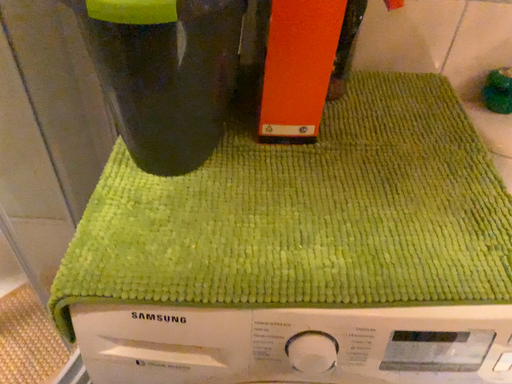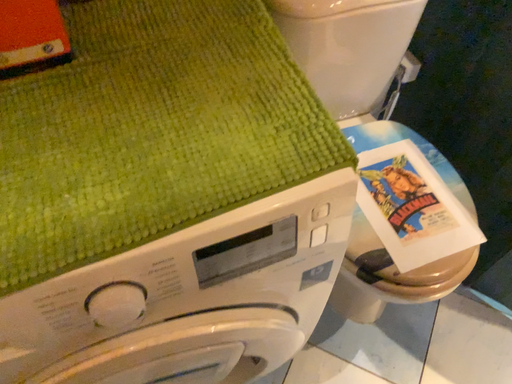
Question: How did the camera likely rotate when shooting the video?

Choices:
 (A) rotated left
 (B) rotated right

Answer: (B)